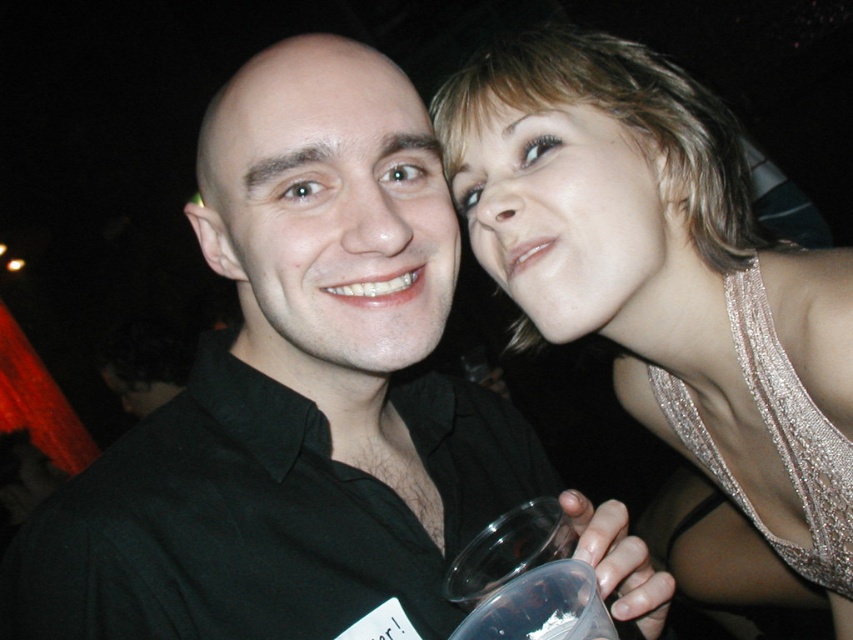
Who is lower down, sparkly gold dress at upper right or smooth skin face at upper right?

sparkly gold dress at upper right is lower down.

What do you see at coordinates (664, 275) in the screenshot?
I see `sparkly gold dress at upper right` at bounding box center [664, 275].

This screenshot has height=640, width=853. Find the location of `sparkly gold dress at upper right`. sparkly gold dress at upper right is located at coordinates (664, 275).

Is point (746, 193) positioned before point (838, 560)?

No, it is not.

Consider the image. Does sparkly gold dress at upper right have a lesser height compared to sparkly silver dress at upper right?

Incorrect, sparkly gold dress at upper right's height does not fall short of sparkly silver dress at upper right's.

Locate an element on the screen. sparkly gold dress at upper right is located at coordinates (664, 275).

Between smooth skin face at upper right and transparent plastic cup at lower center, which one appears on the right side from the viewer's perspective?

From the viewer's perspective, smooth skin face at upper right appears more on the right side.

Based on the photo, does smooth skin face at upper right have a greater height compared to transparent plastic cup at lower center?

Yes.

Measure the distance between smooth skin face at upper right and camera.

28.02 inches

Image resolution: width=853 pixels, height=640 pixels. Identify the location of smooth skin face at upper right. (566, 214).